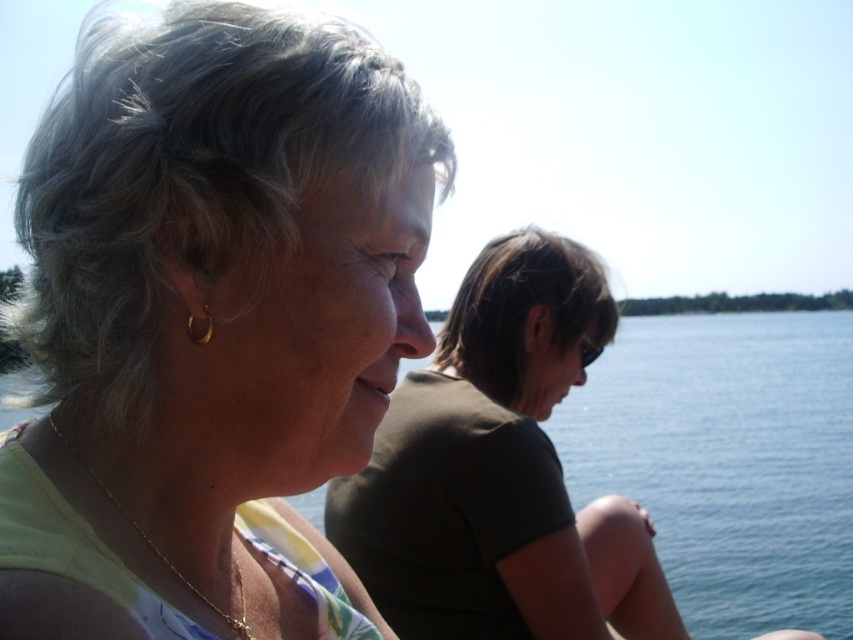
Who is taller, matte yellow blouse at center or dark brown fabric at center?

With more height is dark brown fabric at center.

Which is in front, point (79, 170) or point (389, 506)?

Positioned in front is point (79, 170).

At what (x,y) coordinates should I click in order to perform the action: click on matte yellow blouse at center. Please return your answer as a coordinate pair (x, y). The height and width of the screenshot is (640, 853). Looking at the image, I should click on (227, 269).